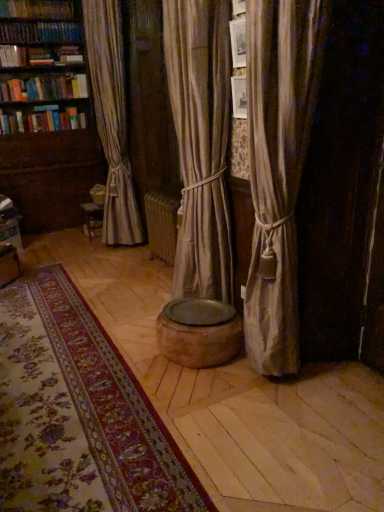
I want to click on free space to the left of silky beige curtain at right, so click(216, 387).